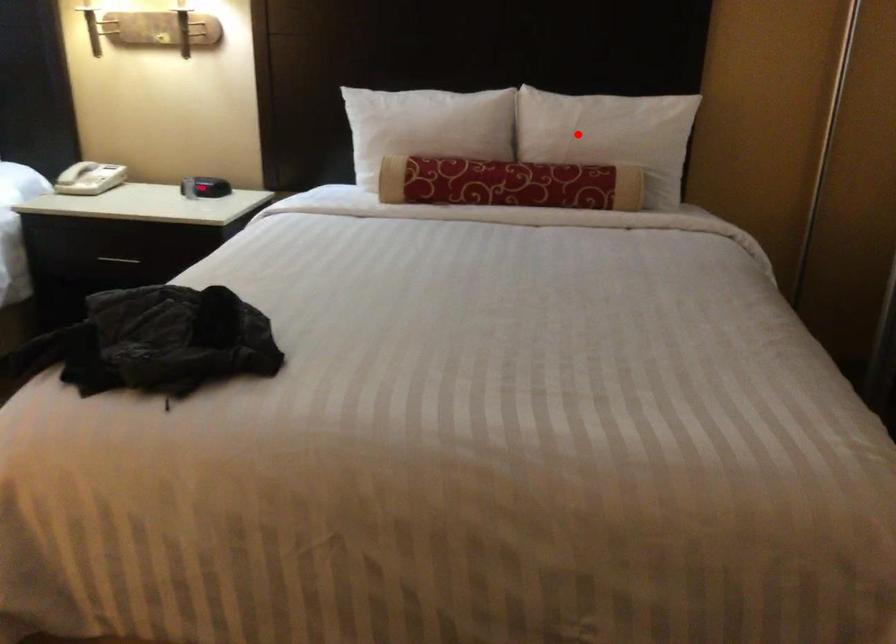
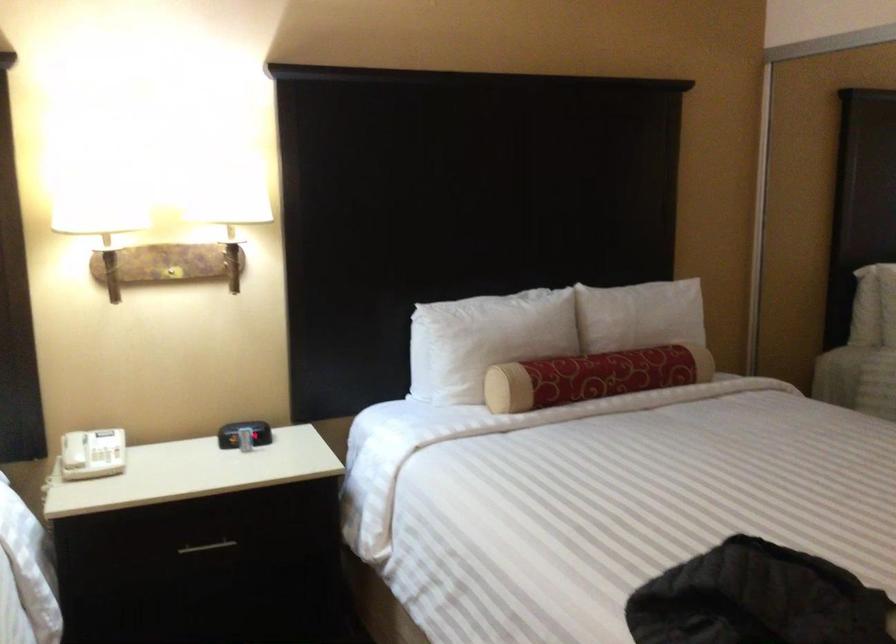
Locate, in the second image, the point that corresponds to the highlighted location in the first image.

(643, 319)